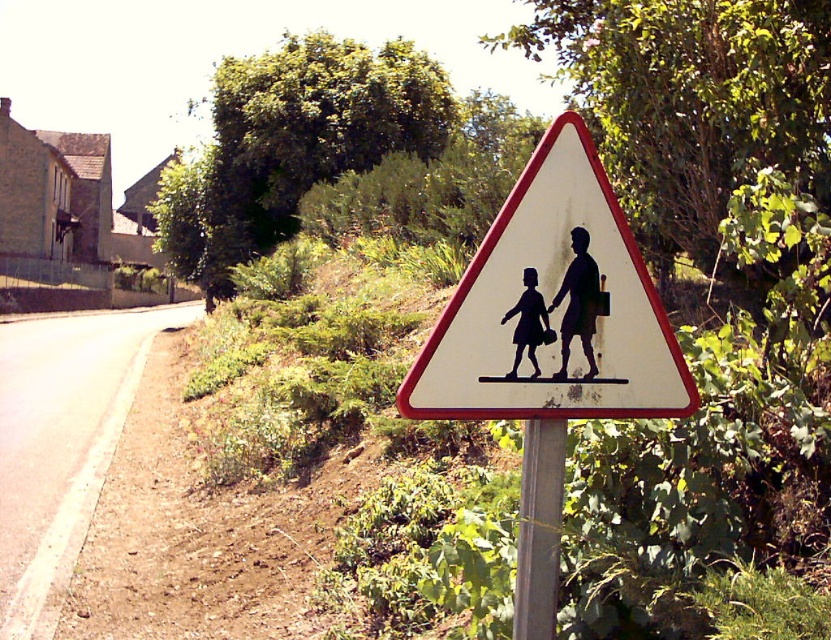
Question: Which point is farther to the camera?

Choices:
 (A) white matte triangle at center
 (B) silhouette paper child at center

Answer: (B)

Question: Is white matte triangle at center smaller than metallic silver pole at center?

Choices:
 (A) yes
 (B) no

Answer: (B)

Question: Which object is positioned closest to the metallic silver pole at center?

Choices:
 (A) silhouette paper child at center
 (B) white matte triangle at center

Answer: (B)

Question: Where is white matte triangle at center located in relation to silhouette paper child at center in the image?

Choices:
 (A) above
 (B) below

Answer: (B)

Question: Observing the image, what is the correct spatial positioning of metallic silver pole at center in reference to silhouette paper child at center?

Choices:
 (A) right
 (B) left

Answer: (A)

Question: Which of the following is the farthest from the observer?

Choices:
 (A) tap(538, 371)
 (B) tap(554, 464)
 (C) tap(588, 202)

Answer: (B)